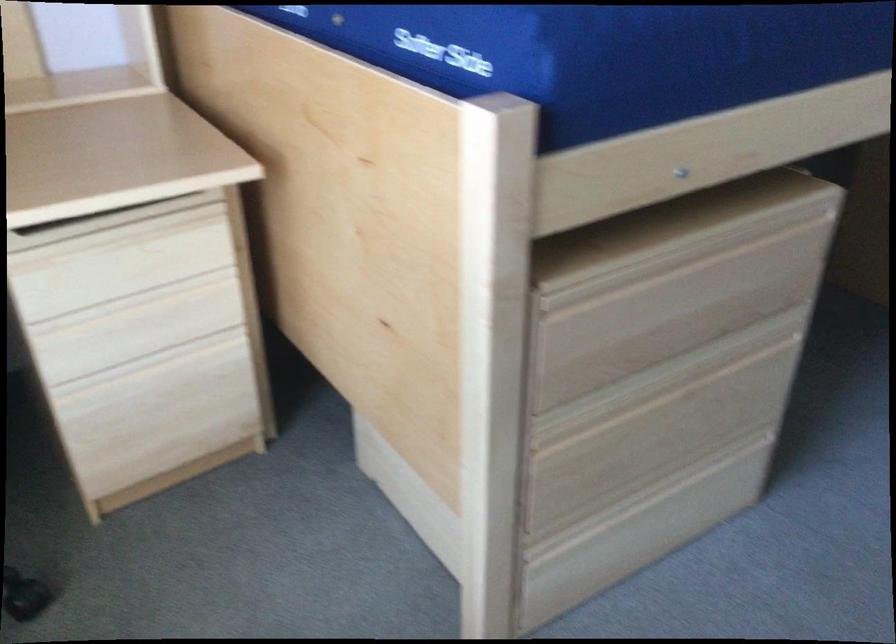
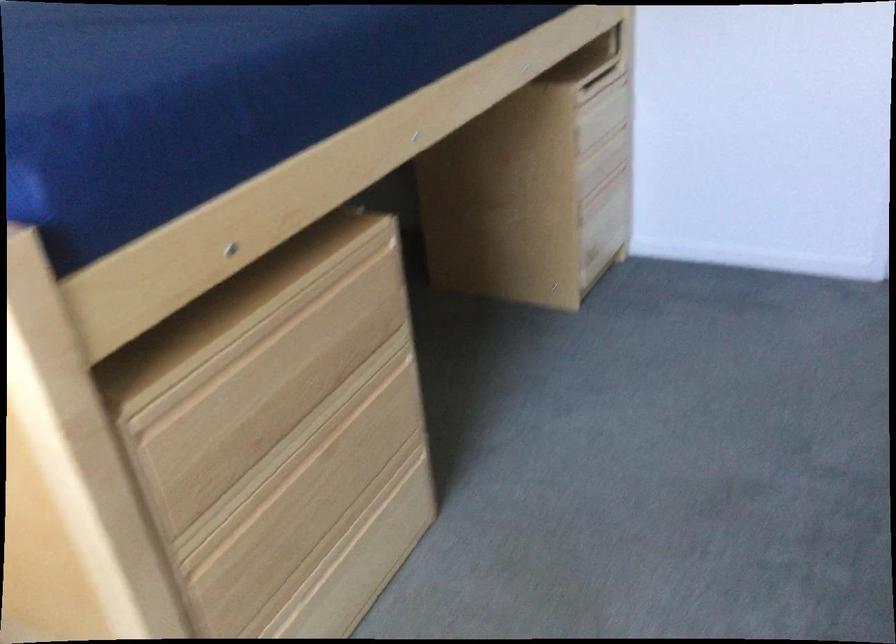
Question: The images are taken continuously from a first-person perspective. In which direction are you moving?

Choices:
 (A) Left
 (B) Right
 (C) Forward
 (D) Backward

Answer: (B)